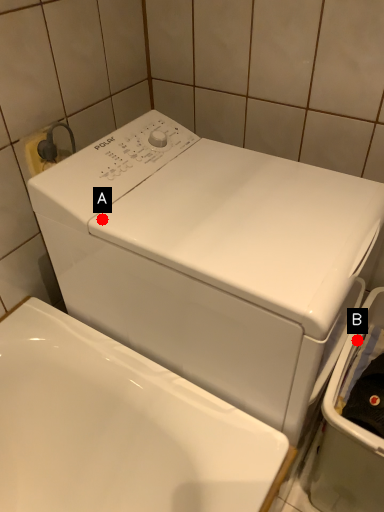
Question: Two points are circled on the image, labeled by A and B beside each circle. Among these points, which one is nearest to the camera?

Choices:
 (A) A is closer
 (B) B is closer

Answer: (A)